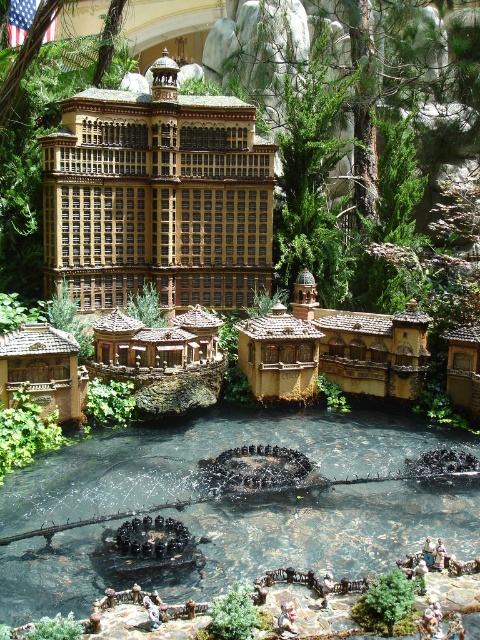
Question: Where is brown textured building at center located in relation to brown wooden hut at center in the image?

Choices:
 (A) below
 (B) above

Answer: (B)

Question: Does brown textured building at center appear on the left side of brown wooden hut at center?

Choices:
 (A) yes
 (B) no

Answer: (A)

Question: Can you confirm if brown textured building at center is positioned above wooden hut at center?

Choices:
 (A) no
 (B) yes

Answer: (B)

Question: Which point is farther from the camera taking this photo?

Choices:
 (A) (450, 397)
 (B) (62, 412)
 (C) (263, 388)
 (D) (86, 109)

Answer: (D)

Question: Which object is the farthest from the brown wooden hut at center?

Choices:
 (A) brown textured building at center
 (B) wooden hut at lower right

Answer: (A)

Question: Which point appears closest to the camera in this image?

Choices:
 (A) pyautogui.click(x=229, y=298)
 (B) pyautogui.click(x=476, y=371)
 (C) pyautogui.click(x=279, y=316)

Answer: (B)